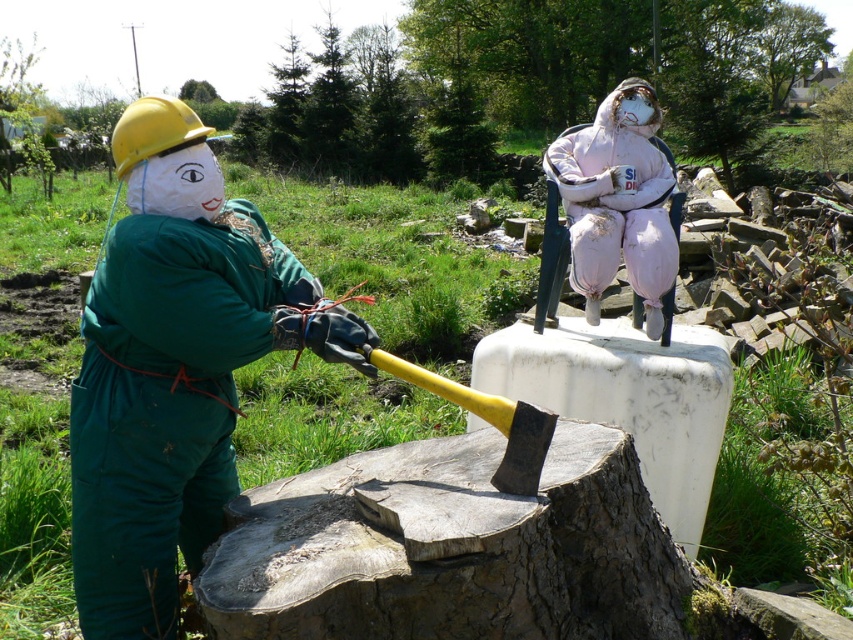
Question: Is green fabric figure at left wider than pink fabric figure at upper center?

Choices:
 (A) yes
 (B) no

Answer: (A)

Question: Does green fabric figure at left appear over pink fabric figure at upper center?

Choices:
 (A) no
 (B) yes

Answer: (A)

Question: Which point is farther to the camera?

Choices:
 (A) (572, 176)
 (B) (158, 125)

Answer: (A)

Question: Can you confirm if green fabric figure at left is positioned above pink fabric figure at upper center?

Choices:
 (A) yes
 (B) no

Answer: (B)